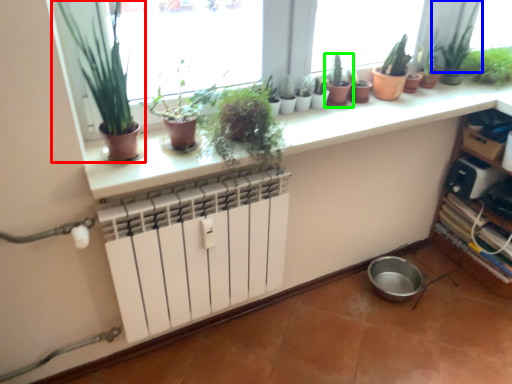
Question: Estimate the real-world distances between objects in this image. Which object is closer to houseplant (highlighted by a red box), plant (highlighted by a blue box) or houseplant (highlighted by a green box)?

Choices:
 (A) plant
 (B) houseplant

Answer: (B)